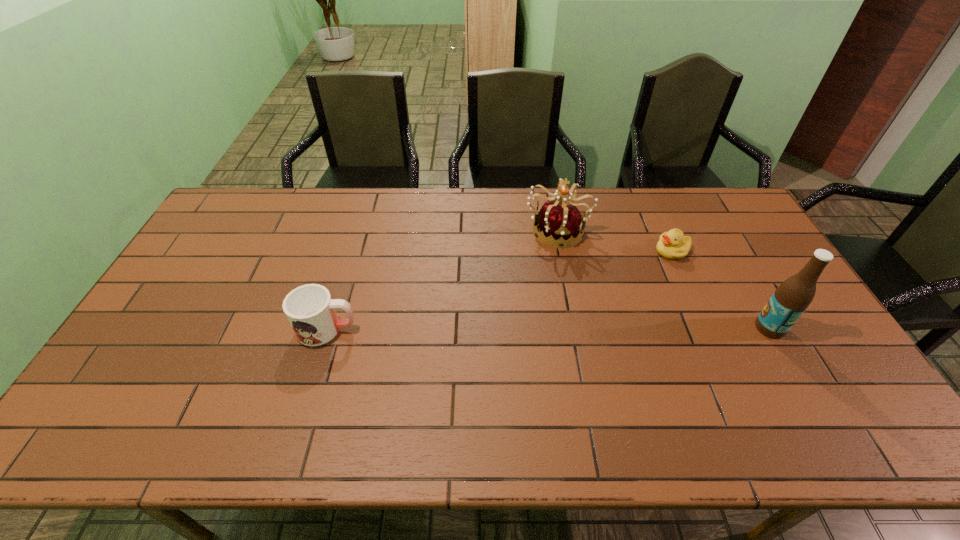
At what (x,y) coordinates should I click in order to perform the action: click on the second shortest object. Please return your answer as a coordinate pair (x, y). This screenshot has width=960, height=540. Looking at the image, I should click on (310, 310).

The width and height of the screenshot is (960, 540). What are the coordinates of `the leftmost object` in the screenshot? It's located at (310, 310).

Identify the location of beer bottle. (794, 295).

Find the location of a particular element. The image size is (960, 540). the tallest object is located at coordinates (794, 295).

Find the location of a particular element. This screenshot has width=960, height=540. tiara is located at coordinates (563, 222).

The height and width of the screenshot is (540, 960). Identify the location of the third object from right to left. (563, 222).

I want to click on duckling, so click(x=673, y=244).

The width and height of the screenshot is (960, 540). Find the location of `the second object from right to left`. the second object from right to left is located at coordinates click(x=673, y=244).

Identify the location of vacant space situated 0.280m on the side of the second shortest object with the handle. This screenshot has width=960, height=540. (459, 329).

Identify the location of vacant space situated 0.340m on the left of the beer bottle. (633, 328).